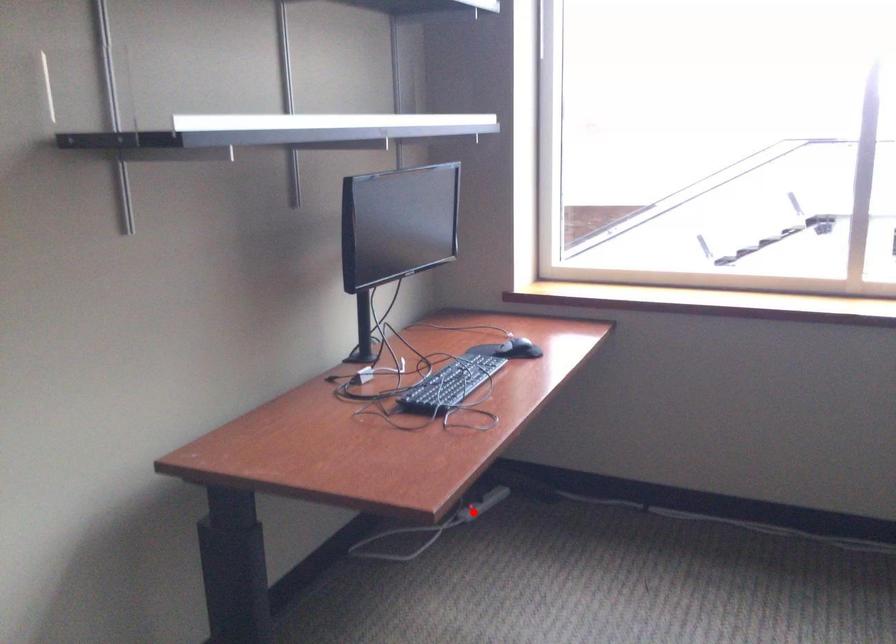
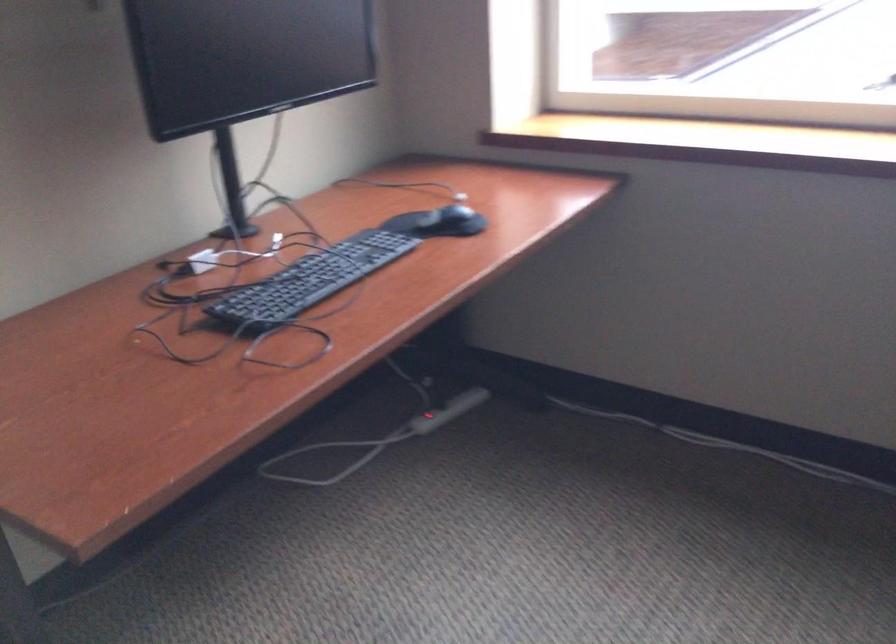
Locate, in the second image, the point that corresponds to the highlighted location in the first image.

(428, 421)